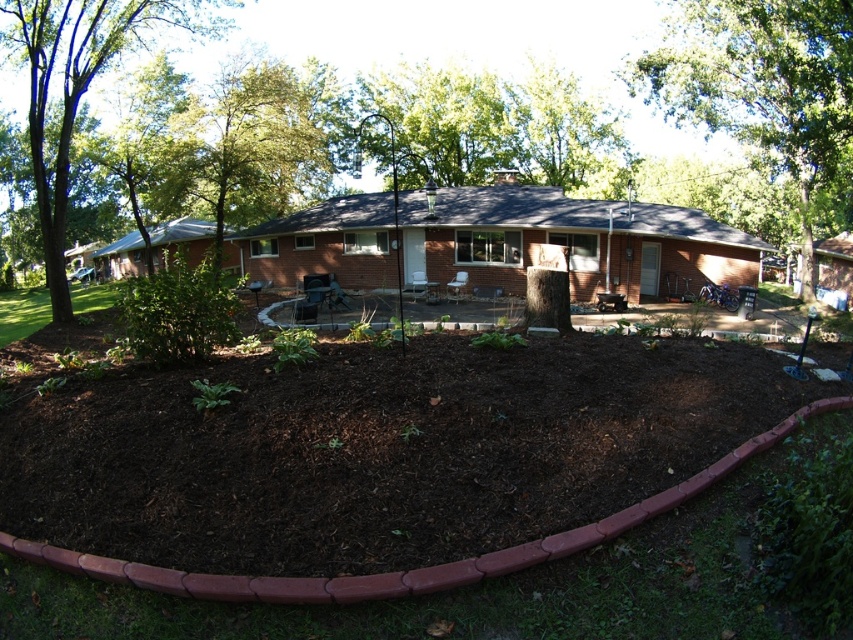
Question: Can you confirm if green leafy tree at upper center is thinner than green leafy tree at upper left?

Choices:
 (A) no
 (B) yes

Answer: (B)

Question: Estimate the real-world distances between objects in this image. Which object is closer to the dark brown mulch at center?

Choices:
 (A) green leafy tree at upper left
 (B) green leafy tree at upper center

Answer: (A)

Question: Which point appears closest to the camera in this image?

Choices:
 (A) click(x=601, y=512)
 (B) click(x=115, y=42)
 (C) click(x=747, y=3)

Answer: (A)

Question: Which object appears closest to the camera in this image?

Choices:
 (A) dark brown mulch at center
 (B) green leafy tree at upper center
 (C) green leafy tree at upper left

Answer: (A)

Question: Can you confirm if green leafy tree at upper center is positioned below green leafy tree at upper left?

Choices:
 (A) yes
 (B) no

Answer: (A)

Question: Is dark brown mulch at center behind green leafy tree at upper center?

Choices:
 (A) no
 (B) yes

Answer: (A)